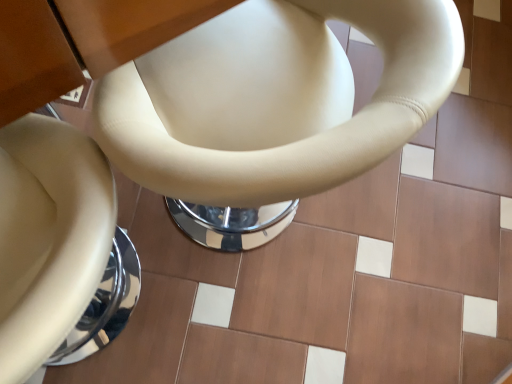
I want to click on vacant space to the right of beige leather toilet at center, so click(x=378, y=257).